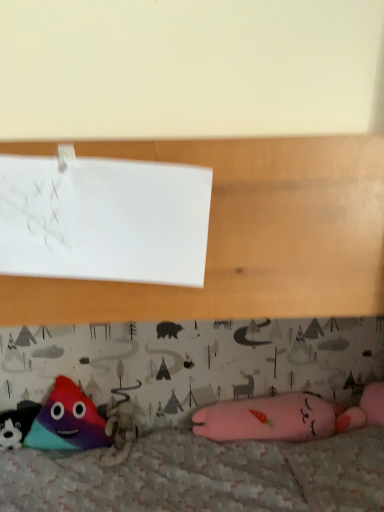
Question: Considering the positions of point (36, 439) and point (253, 425), is point (36, 439) closer or farther from the camera than point (253, 425)?

Choices:
 (A) farther
 (B) closer

Answer: (B)

Question: From a real-world perspective, is multicolored plush triangle at lower left, which ranks as the second toy in left-to-right order, physically located above or below pink plush toy at lower right, positioned as the 1th toy in right-to-left order?

Choices:
 (A) above
 (B) below

Answer: (A)

Question: Which is nearer to the multicolored plush triangle at lower left, arranged as the second toy when viewed from the right?

Choices:
 (A) pink plush toy at lower right, the third toy when ordered from left to right
 (B) white paper at upper left
 (C) multicolored plush toy at lower left, positioned as the 1th toy in left-to-right order

Answer: (C)

Question: Which object is the closest to the multicolored plush toy at lower left, positioned as the 1th toy in left-to-right order?

Choices:
 (A) pink plush toy at lower right, the third toy when ordered from left to right
 (B) multicolored plush triangle at lower left, arranged as the second toy when viewed from the right
 (C) white paper at upper left

Answer: (B)